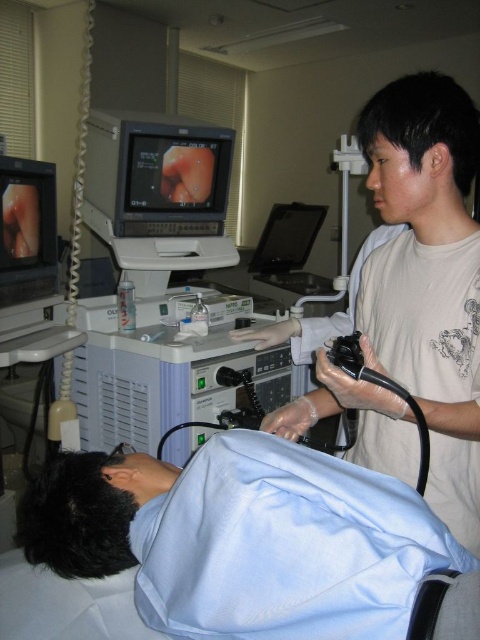
Question: Which point is farther to the camera?

Choices:
 (A) coord(392,180)
 (B) coord(37,284)

Answer: (B)

Question: Among these objects, which one is farthest from the camera?

Choices:
 (A) black glossy monitor at center
 (B) white matte shirt at upper right

Answer: (A)

Question: Is white matte shirt at upper right above black glossy monitor at center?

Choices:
 (A) yes
 (B) no

Answer: (B)

Question: Which is farther from the matte black monitor at left?

Choices:
 (A) black glossy monitor at center
 (B) white matte shirt at upper right

Answer: (A)

Question: Does black glossy monitor at upper center have a smaller size compared to matte black monitor at left?

Choices:
 (A) no
 (B) yes

Answer: (A)

Question: Can you confirm if matte black monitor at left is thinner than black glossy monitor at center?

Choices:
 (A) yes
 (B) no

Answer: (A)